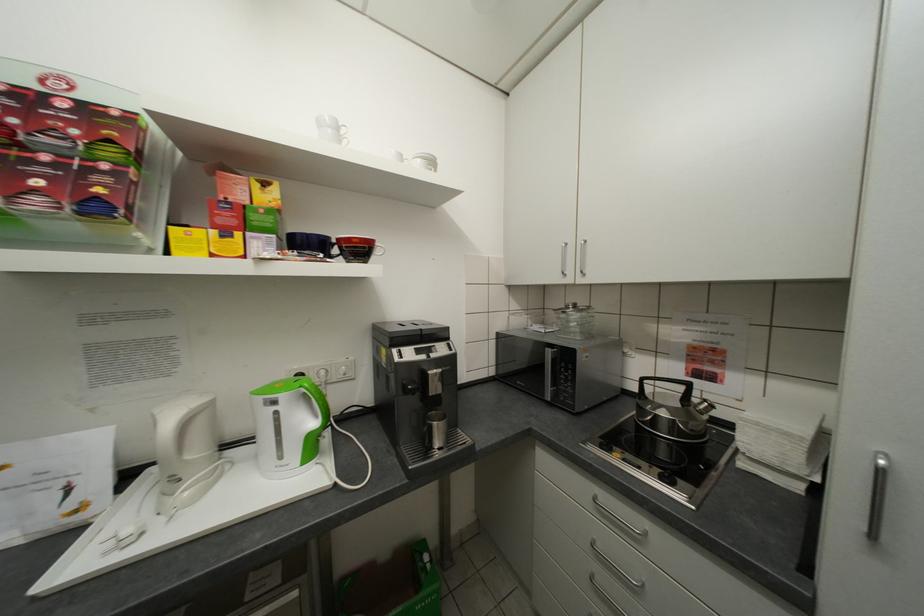
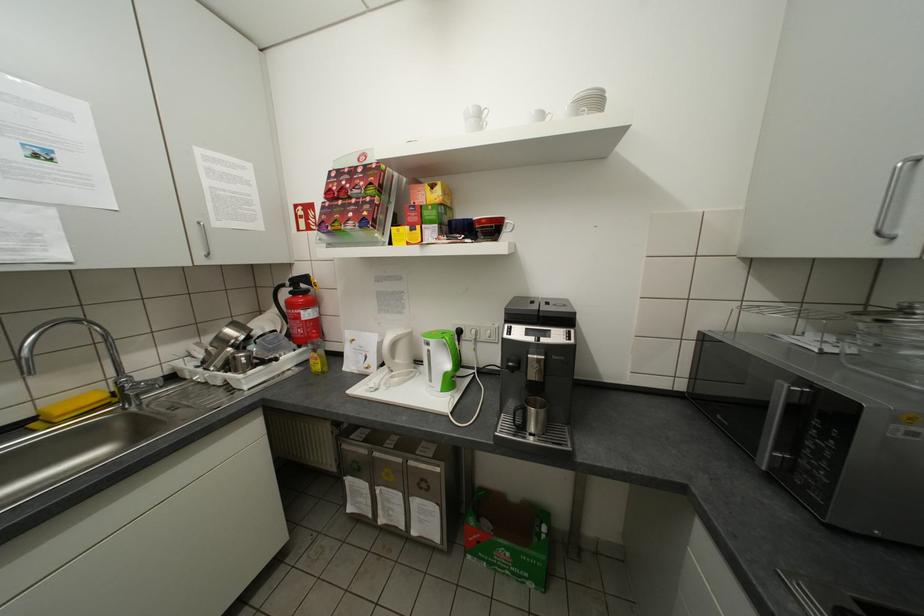
Where in the second image is the point corresponding to point (367, 241) from the first image?

(494, 222)